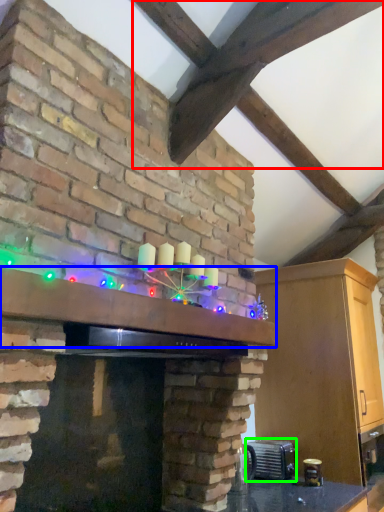
Question: Based on their relative distances, which object is farther from exhaust hood (highlighted by a red box)? Choose from mantle (highlighted by a blue box) and appliance (highlighted by a green box).

Choices:
 (A) mantle
 (B) appliance

Answer: (B)